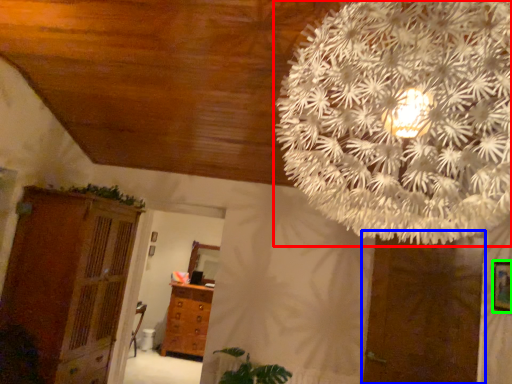
Question: Which is farther away from flower (highlighted by a red box)? door (highlighted by a blue box) or picture frame (highlighted by a green box)?

Choices:
 (A) door
 (B) picture frame

Answer: (A)